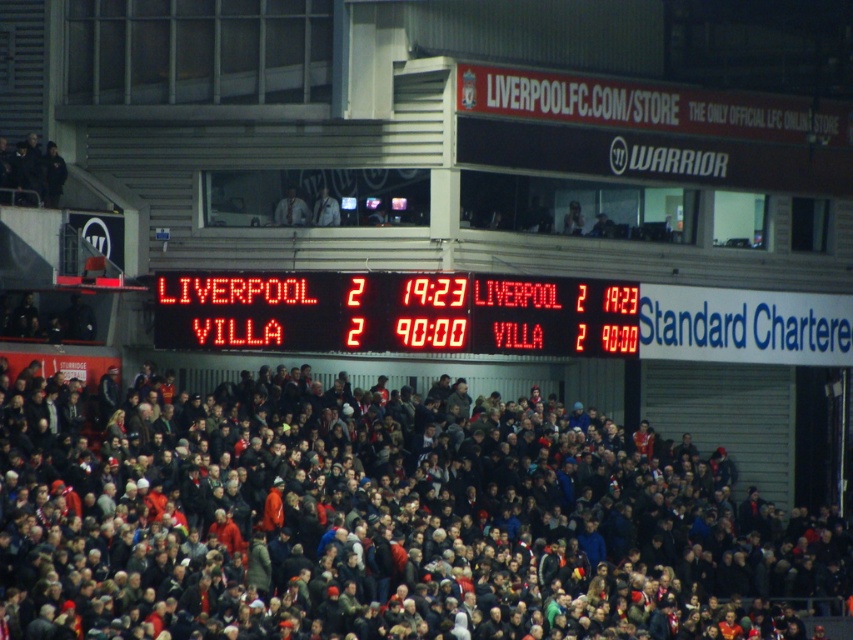
Between dark gray crowd at center and red led scoreboard at center, which one has more height?

Standing taller between the two is dark gray crowd at center.

Can you confirm if dark gray crowd at center is positioned to the right of red led scoreboard at center?

Yes, dark gray crowd at center is to the right of red led scoreboard at center.

Between point (292, 458) and point (177, 296), which one is positioned in front?

Point (292, 458) is more forward.

Identify the location of dark gray crowd at center. This screenshot has height=640, width=853. (399, 547).